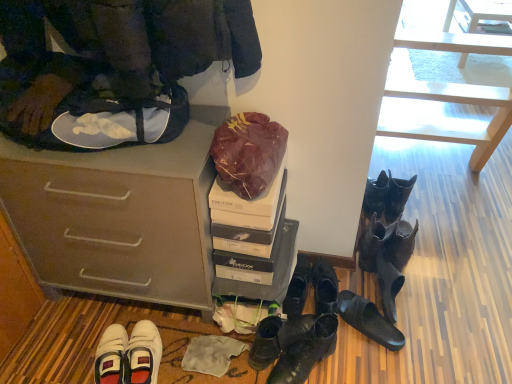
Question: Is black leather boots at lower right, the 6th footwear from the left, to the left of leather boots at center, the 1th footwear positioned from the left, from the viewer's perspective?

Choices:
 (A) yes
 (B) no

Answer: (B)

Question: Is black leather boots at lower right, arranged as the 3th footwear when viewed from the right, smaller than leather boots at center, the 1th footwear positioned from the left?

Choices:
 (A) yes
 (B) no

Answer: (B)

Question: Does black leather boots at lower right, the 6th footwear from the left, touch leather boots at center, the 1th footwear positioned from the left?

Choices:
 (A) yes
 (B) no

Answer: (B)

Question: From the image's perspective, is black leather boots at lower right, arranged as the 3th footwear when viewed from the right, located above leather boots at center, acting as the eighth footwear starting from the right?

Choices:
 (A) yes
 (B) no

Answer: (A)

Question: From a real-world perspective, is black leather boots at lower right, arranged as the 3th footwear when viewed from the right, beneath leather boots at center, acting as the eighth footwear starting from the right?

Choices:
 (A) no
 (B) yes

Answer: (A)

Question: Is shiny black boots at center, the 7th footwear viewed from the right, wider or thinner than black rubber sandals at lower center, arranged as the 5th footwear when viewed from the left?

Choices:
 (A) thin
 (B) wide

Answer: (B)

Question: Based on their positions, is shiny black boots at center, placed as the 2th footwear when sorted from left to right, located to the left or right of black rubber sandals at lower center, arranged as the 5th footwear when viewed from the left?

Choices:
 (A) right
 (B) left

Answer: (B)

Question: Is shiny black boots at center, placed as the 2th footwear when sorted from left to right, in front of or behind black rubber sandals at lower center, the fourth footwear from the right, in the image?

Choices:
 (A) behind
 (B) front

Answer: (B)

Question: In terms of size, does shiny black boots at center, the 7th footwear viewed from the right, appear bigger or smaller than black rubber sandals at lower center, arranged as the 5th footwear when viewed from the left?

Choices:
 (A) small
 (B) big

Answer: (B)

Question: Would you say black leather shoes at lower center, the fourth footwear when ordered from left to right, is to the left or to the right of black leather boots at lower right, the 6th footwear from the left, in the picture?

Choices:
 (A) left
 (B) right

Answer: (A)

Question: Considering the positions of black leather shoes at lower center, the fourth footwear when ordered from left to right, and black leather boots at lower right, arranged as the 3th footwear when viewed from the right, in the image, is black leather shoes at lower center, the fourth footwear when ordered from left to right, taller or shorter than black leather boots at lower right, arranged as the 3th footwear when viewed from the right,?

Choices:
 (A) short
 (B) tall

Answer: (A)

Question: Choose the correct answer: Is black leather shoes at lower center, the fourth footwear when ordered from left to right, inside black leather boots at lower right, the 6th footwear from the left, or outside it?

Choices:
 (A) inside
 (B) outside

Answer: (B)

Question: Based on their sizes in the image, would you say black leather shoes at lower center, the fourth footwear when ordered from left to right, is bigger or smaller than black leather boots at lower right, the 6th footwear from the left?

Choices:
 (A) small
 (B) big

Answer: (A)

Question: From the image's perspective, is burgundy fabric bag at upper center above or below shiny black boots at center, placed as the 2th footwear when sorted from left to right?

Choices:
 (A) above
 (B) below

Answer: (A)

Question: Considering the relative positions of burgundy fabric bag at upper center and shiny black boots at center, the 7th footwear viewed from the right, in the image provided, is burgundy fabric bag at upper center to the left or to the right of shiny black boots at center, the 7th footwear viewed from the right,?

Choices:
 (A) left
 (B) right

Answer: (A)